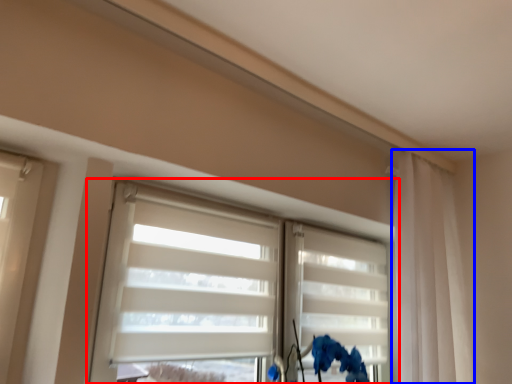
Question: Which object is closer to the camera taking this photo, window (highlighted by a red box) or curtain (highlighted by a blue box)?

Choices:
 (A) window
 (B) curtain

Answer: (A)